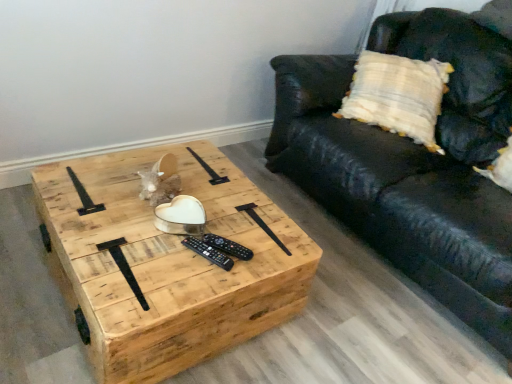
Locate an element on the screen. The height and width of the screenshot is (384, 512). vacant area that is situated to the right of black plastic remote at center, which is the 1th remote from back to front is located at coordinates pyautogui.click(x=270, y=250).